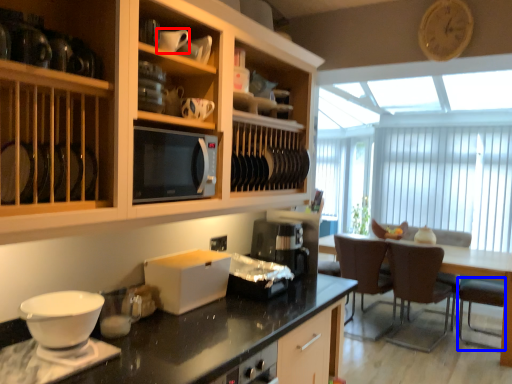
Question: Which object appears farthest to the camera in this image, tableware (highlighted by a red box) or armchair (highlighted by a blue box)?

Choices:
 (A) tableware
 (B) armchair

Answer: (B)